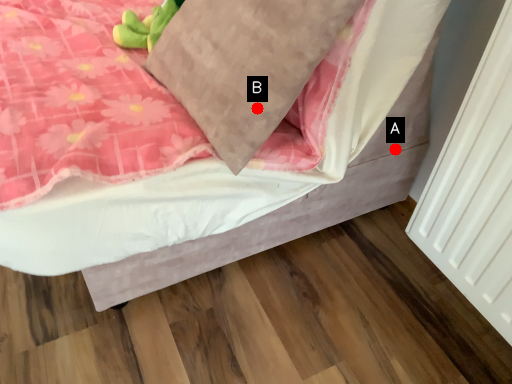
Question: Two points are circled on the image, labeled by A and B beside each circle. Which of the following is the closest to the observer?

Choices:
 (A) A is closer
 (B) B is closer

Answer: (B)